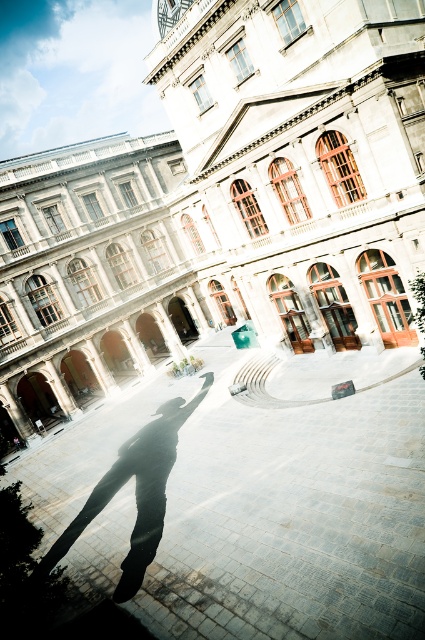
Question: Which point appears closest to the camera in this image?

Choices:
 (A) (138, 490)
 (B) (129, 163)
 (C) (257, 566)

Answer: (C)

Question: Does smooth stone pavement at center lie behind black matte skateboard at center?

Choices:
 (A) yes
 (B) no

Answer: (B)

Question: Is white stone building at center thinner than black matte skateboard at center?

Choices:
 (A) yes
 (B) no

Answer: (B)

Question: Which object appears closest to the camera in this image?

Choices:
 (A) black matte skateboard at center
 (B) white stone building at center
 (C) smooth stone pavement at center

Answer: (C)

Question: Among these objects, which one is nearest to the camera?

Choices:
 (A) smooth stone pavement at center
 (B) black matte skateboard at center

Answer: (A)

Question: Considering the relative positions of white stone building at center and black matte skateboard at center in the image provided, where is white stone building at center located with respect to black matte skateboard at center?

Choices:
 (A) left
 (B) right

Answer: (B)